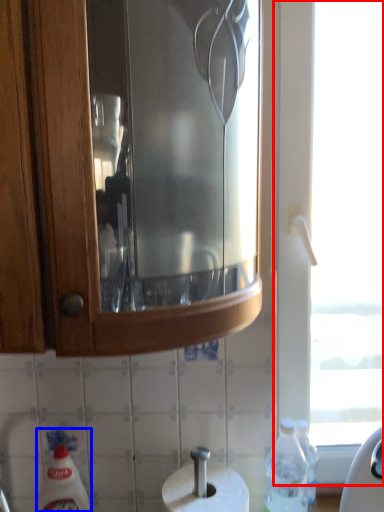
Question: Among these objects, which one is farthest to the camera, window (highlighted by a red box) or cleaning product (highlighted by a blue box)?

Choices:
 (A) window
 (B) cleaning product

Answer: (A)